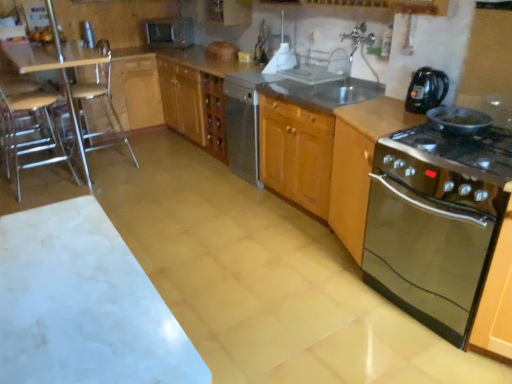
Locate an element on the screen. free space in front of clear plastic bar stool at left, the first bar stool viewed from the right is located at coordinates (112, 184).